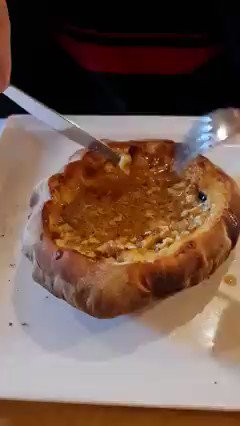
I want to click on plate, so [x=145, y=356].